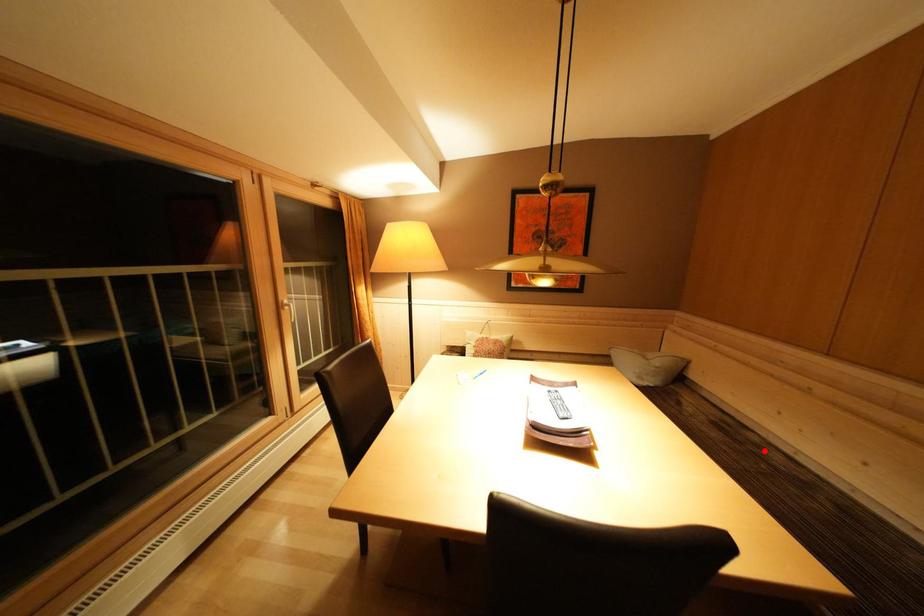
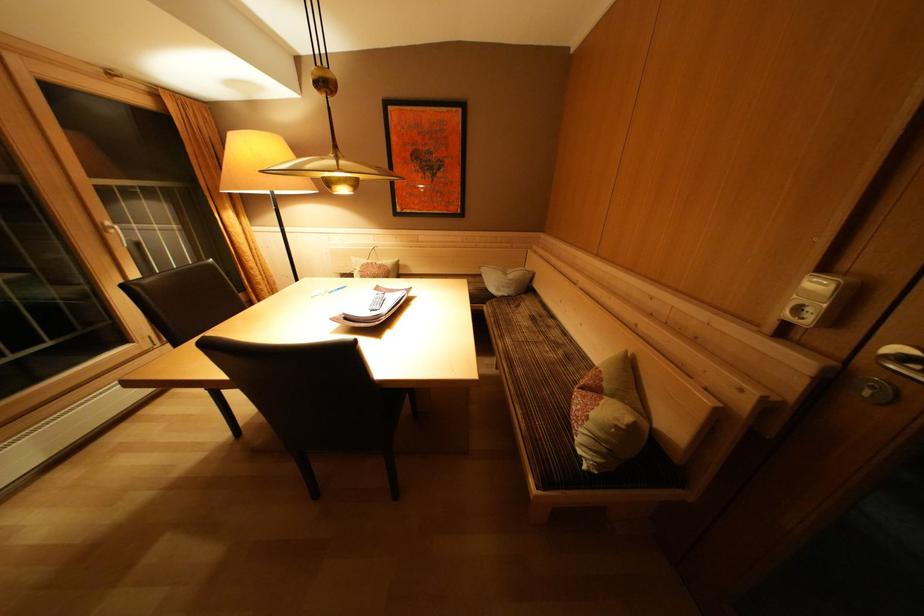
Where in the second image is the point corresponding to the highlighted location from the first image?

(555, 331)